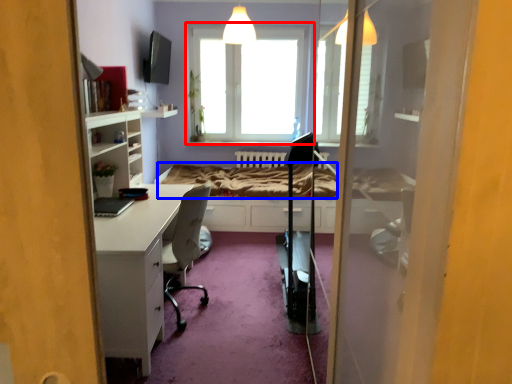
Question: Among these objects, which one is nearest to the camera, window (highlighted by a red box) or bed frame (highlighted by a blue box)?

Choices:
 (A) window
 (B) bed frame

Answer: (B)